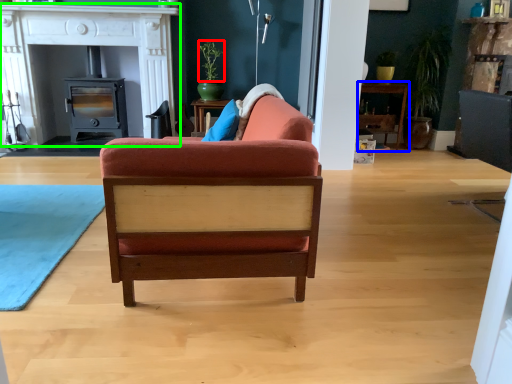
Question: Based on their relative distances, which object is nearer to plant (highlighted by a red box)? Choose from table (highlighted by a blue box) and fireplace (highlighted by a green box).

Choices:
 (A) table
 (B) fireplace

Answer: (B)